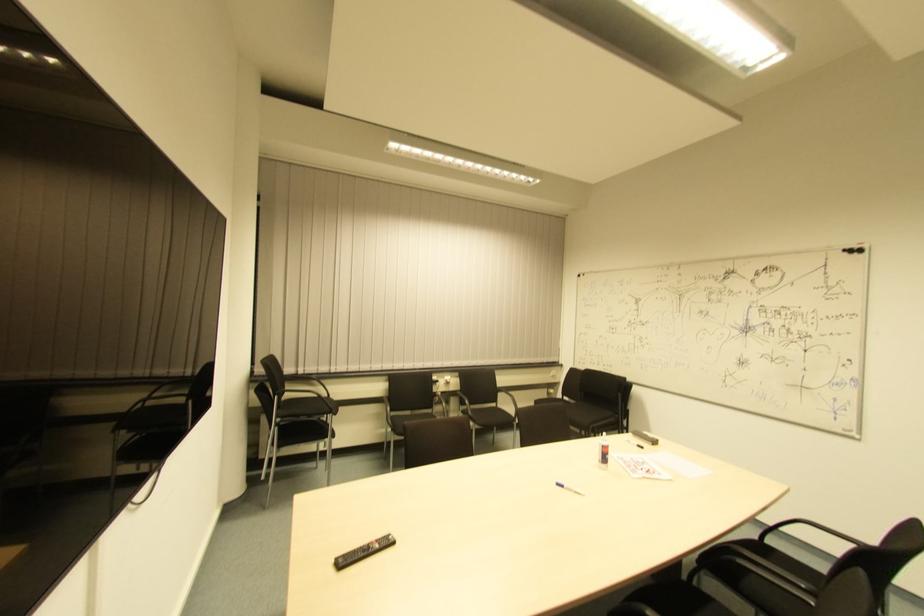
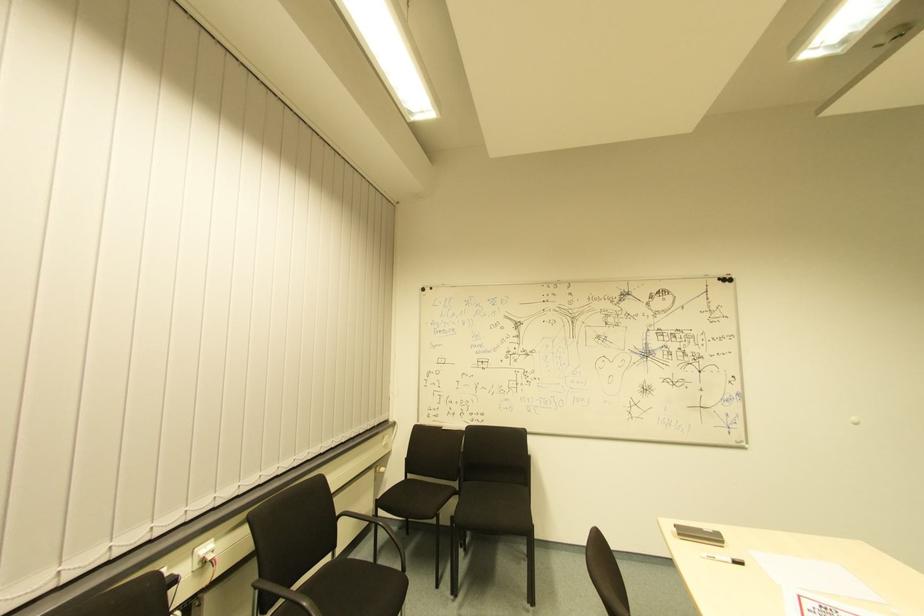
Locate, in the second image, the point that corresponds to point (446, 384) in the first image.

(208, 561)